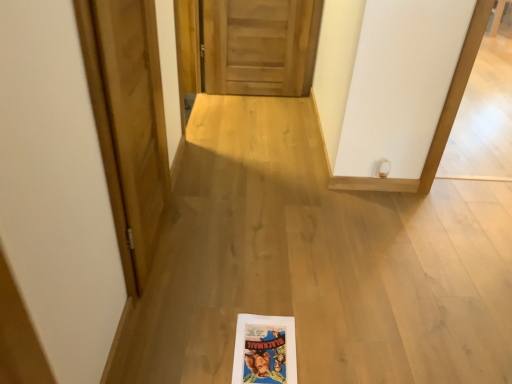
Question: Is point coord(283,94) closer or farther from the camera than point coord(99,34)?

Choices:
 (A) farther
 (B) closer

Answer: (A)

Question: From the image's perspective, is wooden at center, the 2th door positioned from the front, located above or below wooden door at left, which is counted as the second door, starting from the back?

Choices:
 (A) above
 (B) below

Answer: (A)

Question: Considering the positions of wooden at center, the 2th door when ordered from bottom to top, and wooden door at left, which ranks as the first door in bottom-to-top order, in the image, is wooden at center, the 2th door when ordered from bottom to top, taller or shorter than wooden door at left, which ranks as the first door in bottom-to-top order,?

Choices:
 (A) tall
 (B) short

Answer: (B)

Question: Is wooden door at left, which ranks as the first door in left-to-right order, bigger or smaller than wooden at center, the 2th door positioned from the front?

Choices:
 (A) big
 (B) small

Answer: (B)

Question: Is point (115, 72) positioned closer to the camera than point (302, 94)?

Choices:
 (A) farther
 (B) closer

Answer: (B)

Question: Is wooden door at left, the second door viewed from the right, wider or thinner than wooden at center, which ranks as the first door in top-to-bottom order?

Choices:
 (A) thin
 (B) wide

Answer: (A)

Question: In the image, is wooden door at left, which ranks as the first door in left-to-right order, positioned in front of or behind wooden at center, which is the second door from left to right?

Choices:
 (A) behind
 (B) front

Answer: (B)